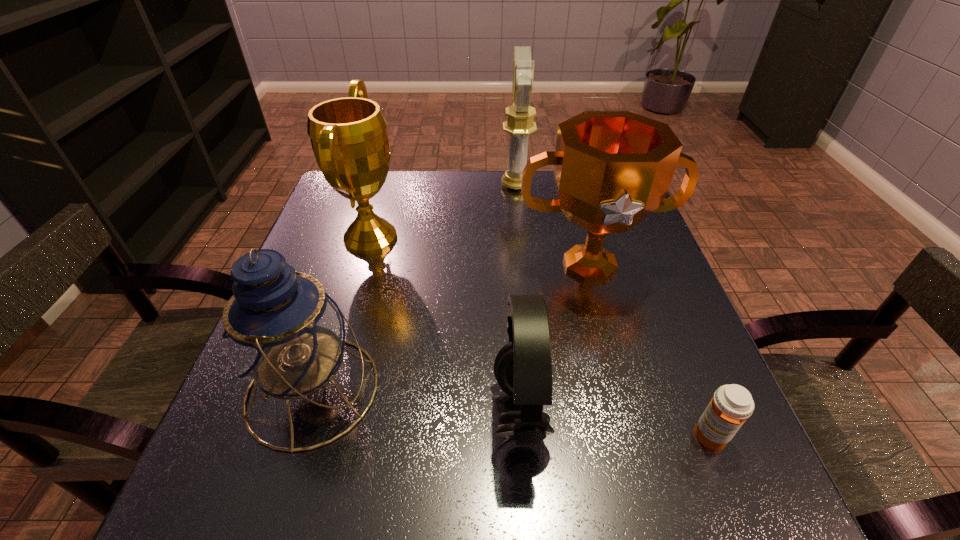
Where is `vacant space positioned on the ear cups of the fifth tallest object`? The image size is (960, 540). vacant space positioned on the ear cups of the fifth tallest object is located at coordinates (342, 411).

The height and width of the screenshot is (540, 960). In order to click on vacant area situated 0.110m on the ear cups of the fifth tallest object in this screenshot , I will do `click(427, 411)`.

I want to click on free space located on the ear cups of the fifth tallest object, so click(451, 411).

The height and width of the screenshot is (540, 960). Find the location of `free spot located on the back of the shortest object`. free spot located on the back of the shortest object is located at coordinates (685, 374).

Where is `object present at the near edge`? This screenshot has width=960, height=540. object present at the near edge is located at coordinates (523, 368).

Image resolution: width=960 pixels, height=540 pixels. Find the location of `award positioned at the left edge`. award positioned at the left edge is located at coordinates (349, 138).

Locate an element on the screen. The image size is (960, 540). lantern located at the left edge is located at coordinates (284, 334).

You are a GUI agent. You are given a task and a screenshot of the screen. Output one action in this format:
    pyautogui.click(x=<x>, y=<y>)
    Task: Click on the award positioned at the right edge
    This screenshot has width=960, height=540.
    Given the screenshot: What is the action you would take?
    pyautogui.click(x=612, y=169)

At what (x,y) coordinates should I click in order to perform the action: click on medicine located at the right edge. Please return your answer as a coordinate pair (x, y). Looking at the image, I should click on (731, 405).

You are a GUI agent. You are given a task and a screenshot of the screen. Output one action in this format:
    pyautogui.click(x=<x>, y=<y>)
    Task: Click on the object that is at the far left corner
    The image size is (960, 540).
    Given the screenshot: What is the action you would take?
    pyautogui.click(x=349, y=138)